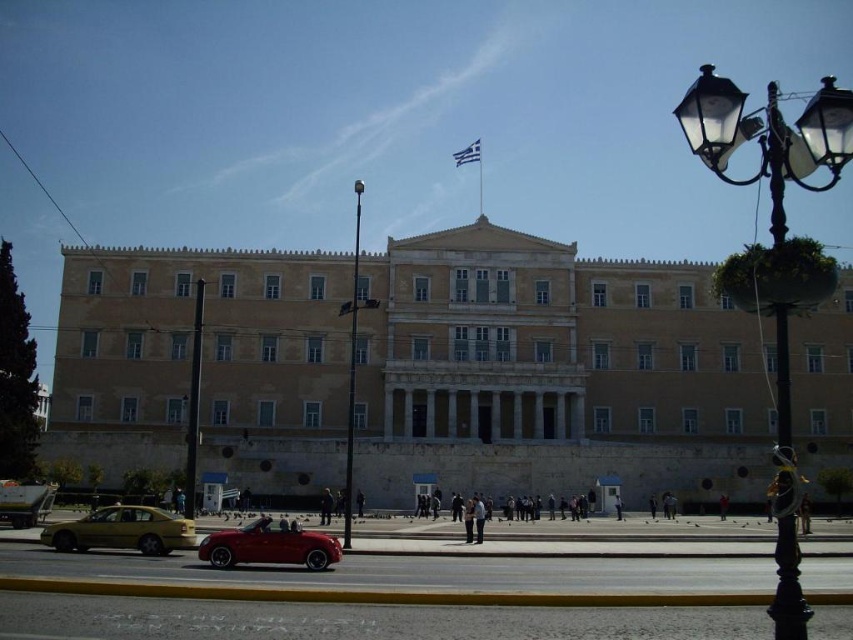
Question: Can you confirm if beige stone building at center is thinner than black glass streetlight at right?

Choices:
 (A) yes
 (B) no

Answer: (B)

Question: Is black glass streetlight at right thinner than black glass pole at center?

Choices:
 (A) yes
 (B) no

Answer: (B)

Question: Does beige stone building at center appear on the right side of yellow matte sedan at lower left?

Choices:
 (A) yes
 (B) no

Answer: (A)

Question: Which of these objects is positioned farthest from the yellow matte sedan at lower left?

Choices:
 (A) black glass pole at center
 (B) black glass streetlight at right
 (C) beige stone building at center

Answer: (B)

Question: Among these points, which one is farthest from the camera?

Choices:
 (A) (196, 548)
 (B) (183, 516)
 (C) (352, 422)

Answer: (C)

Question: Which of the following is the closest to the observer?

Choices:
 (A) (325, 326)
 (B) (828, 106)
 (C) (129, 532)
 (D) (322, 568)

Answer: (B)